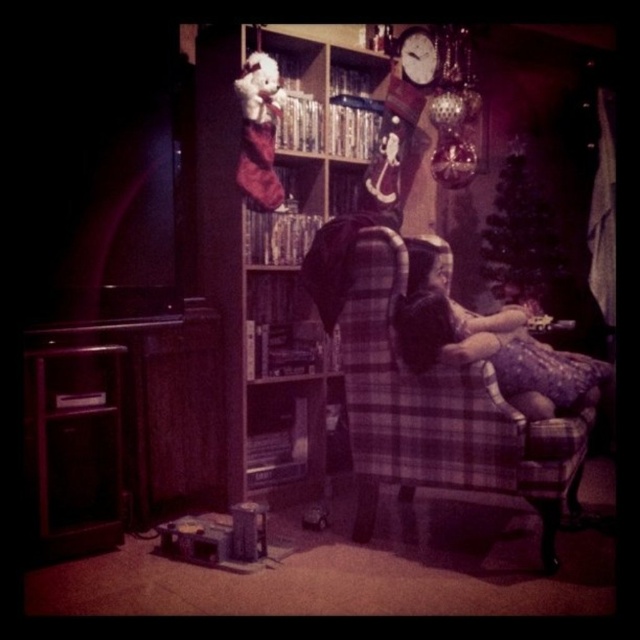
Is plaid fabric chair at center wider than plaid fabric armchair at center?

Indeed, plaid fabric chair at center has a greater width compared to plaid fabric armchair at center.

Measure the distance between plaid fabric chair at center and camera.

plaid fabric chair at center is 2.60 meters from camera.

Identify the location of plaid fabric chair at center. The height and width of the screenshot is (640, 640). (276, 257).

Does point (369, 234) come closer to viewer compared to point (426, 312)?

No, (369, 234) is behind (426, 312).

Consider the image. Can you confirm if plaid fabric armchair at center is positioned to the right of matte purple dress at center?

No, plaid fabric armchair at center is not to the right of matte purple dress at center.

Which is behind, point (362, 236) or point (564, 385)?

The point (362, 236) is more distant.

At what (x,y) coordinates should I click in order to perform the action: click on plaid fabric armchair at center. Please return your answer as a coordinate pair (x, y). This screenshot has width=640, height=640. Looking at the image, I should click on (438, 404).

Which is more to the left, plaid fabric chair at center or matte purple dress at center?

plaid fabric chair at center

Does plaid fabric chair at center appear over matte purple dress at center?

Yes, plaid fabric chair at center is above matte purple dress at center.

This screenshot has width=640, height=640. Identify the location of plaid fabric chair at center. (276, 257).